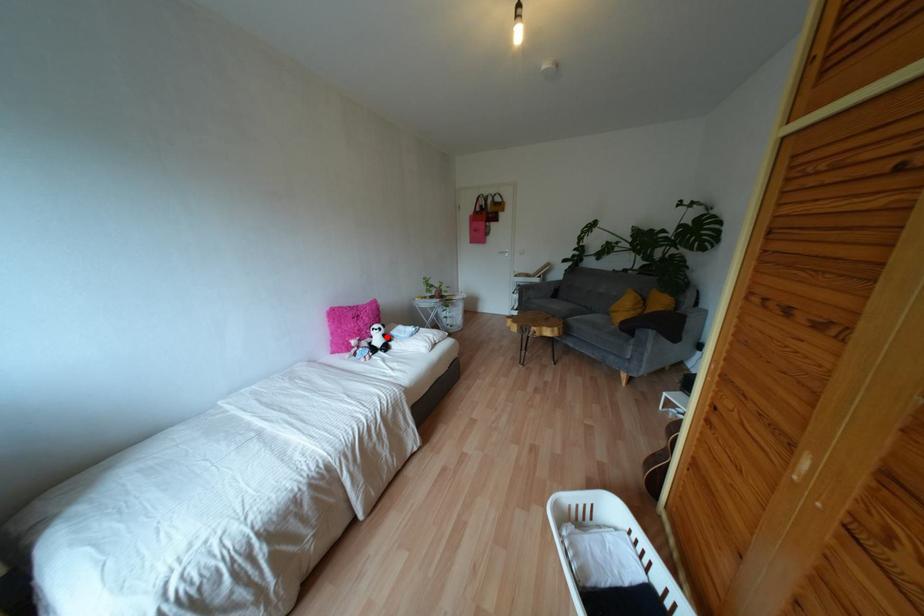
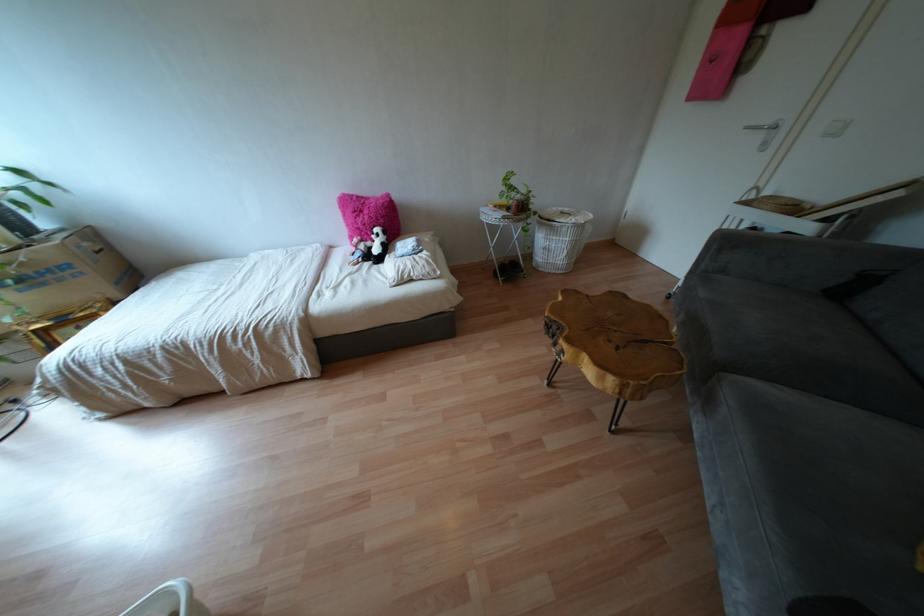
Locate, in the second image, the point that corresponds to the highlighted location in the first image.

(385, 248)